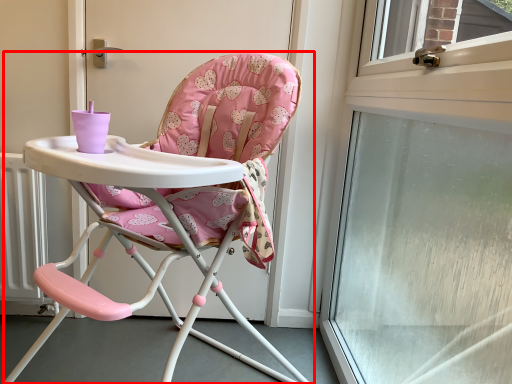
Question: In this image, where is chair (annotated by the red box) located relative to window?

Choices:
 (A) left
 (B) right

Answer: (A)